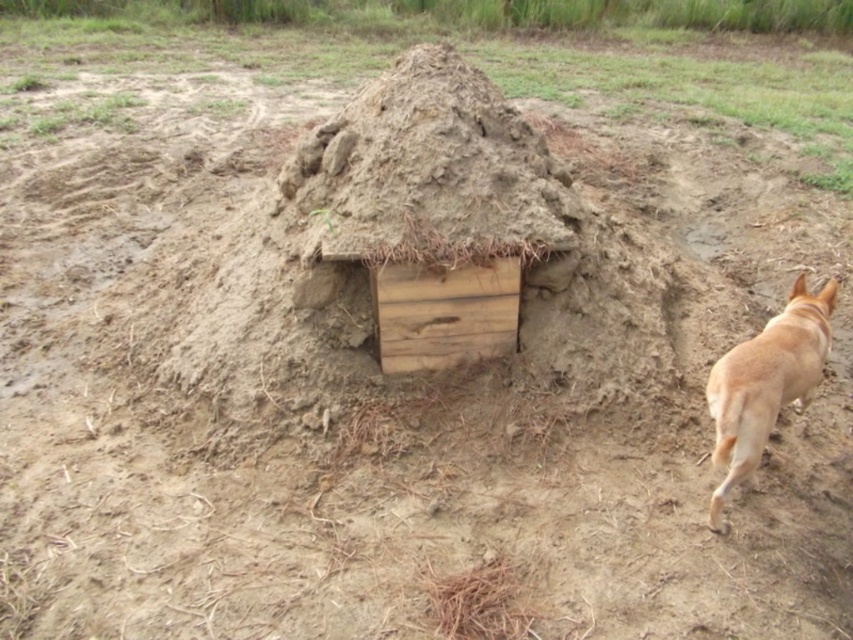
Question: Which point appears closest to the camera in this image?

Choices:
 (A) (776, 413)
 (B) (386, 168)

Answer: (A)

Question: From the image, what is the correct spatial relationship of clayey dirt mound at center in relation to brown furry dog at right?

Choices:
 (A) above
 (B) below

Answer: (A)

Question: Is clayey dirt mound at center below brown furry dog at right?

Choices:
 (A) no
 (B) yes

Answer: (A)

Question: Which point is closer to the camera?

Choices:
 (A) (403, 220)
 (B) (747, 371)

Answer: (B)

Question: Which point is farther to the camera?

Choices:
 (A) (494, 108)
 (B) (718, 390)

Answer: (A)

Question: Is clayey dirt mound at center positioned at the back of brown furry dog at right?

Choices:
 (A) yes
 (B) no

Answer: (A)